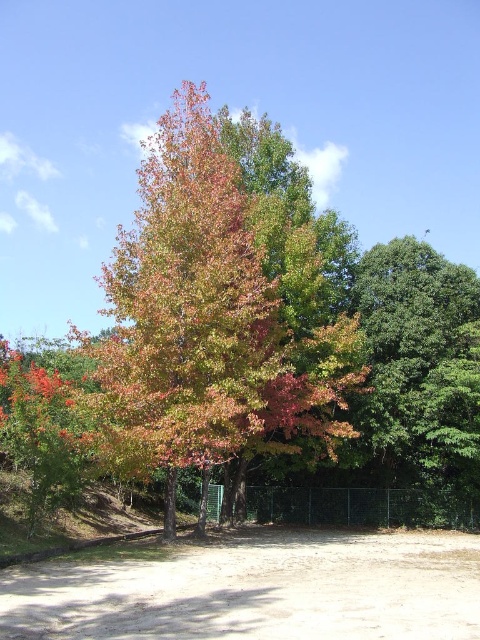
You are standing at the edge of the brown sandy dirt field at lower center and want to walk towards the green glossy tree at right. Which direction should you head to reach the tree?

Since the brown sandy dirt field at lower center is in front of the green glossy tree at right, you should walk forward towards the tree to reach it.

You are standing in the middle of a forest path and see the multicolored foliage at center. If you want to take a photo of it, where should you position yourself relative to the fence?

The multicolored foliage at center is located at coordinates 0.500 on the x and 0.440 on the y, which places it slightly above the center of the image. To capture it in your photo, position yourself so that the foliage is centered above the fence in the lower part of the image.

You are standing at the edge of the brown sandy dirt field at lower center and want to reach the green glossy tree at right. Which direction should you move to get closer to the tree?

The green glossy tree at right is taller than the brown sandy dirt field at lower center. To reach it, move towards the right side of the dirt field since the tree is positioned to the right of the field.